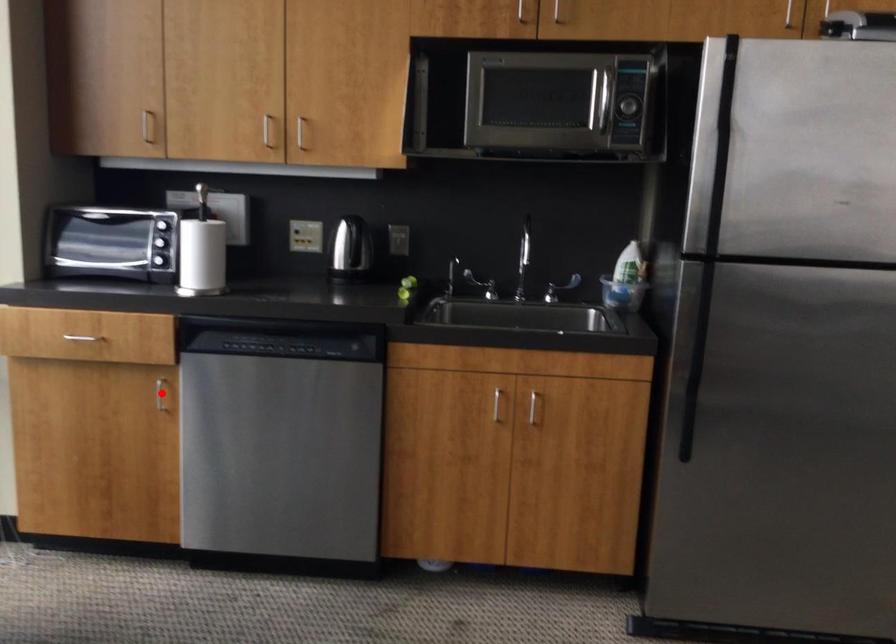
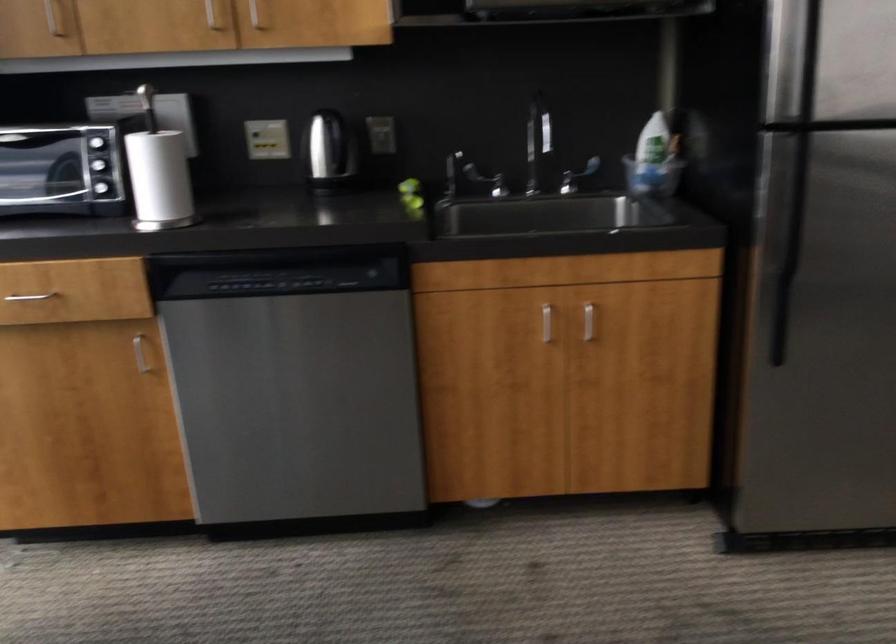
Locate, in the second image, the point that corresponds to the highlighted location in the first image.

(140, 354)